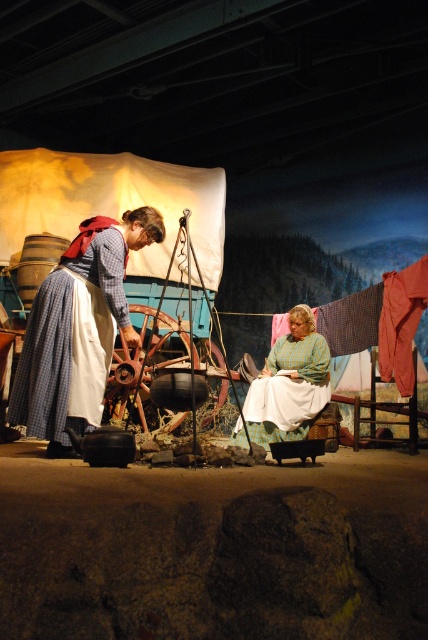
Question: Observing the image, what is the correct spatial positioning of blue plaid dress at left in reference to green plaid dress at center?

Choices:
 (A) below
 (B) above

Answer: (B)

Question: Among these points, which one is nearest to the camera?

Choices:
 (A) (62, 326)
 (B) (314, 320)

Answer: (A)

Question: Which point is farther to the camera?

Choices:
 (A) green plaid dress at center
 (B) blue plaid dress at left

Answer: (A)

Question: Is blue plaid dress at left bigger than green plaid dress at center?

Choices:
 (A) no
 (B) yes

Answer: (A)

Question: Is blue plaid dress at left positioned at the back of green plaid dress at center?

Choices:
 (A) yes
 (B) no

Answer: (B)